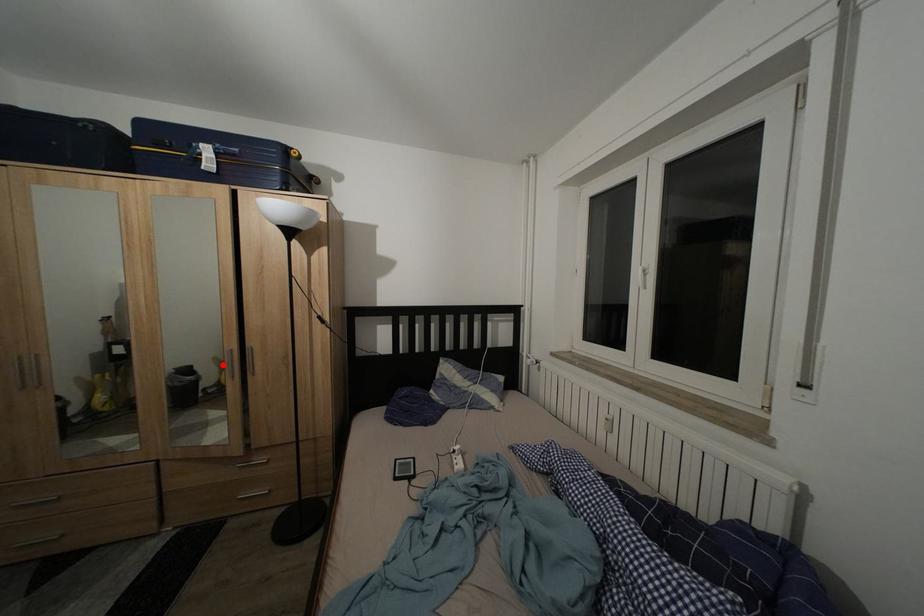
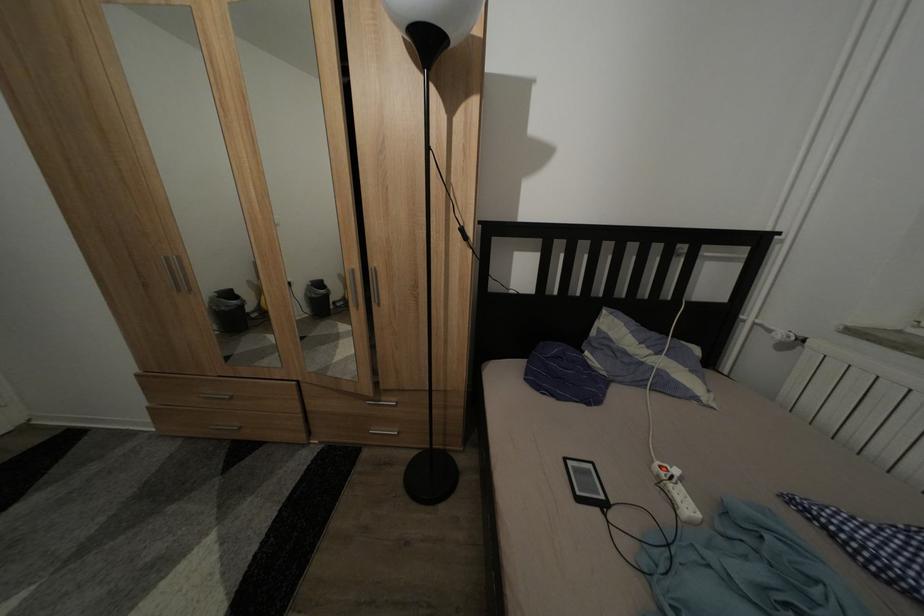
The point at the highlighted location is marked in the first image. Where is the corresponding point in the second image?

(347, 282)